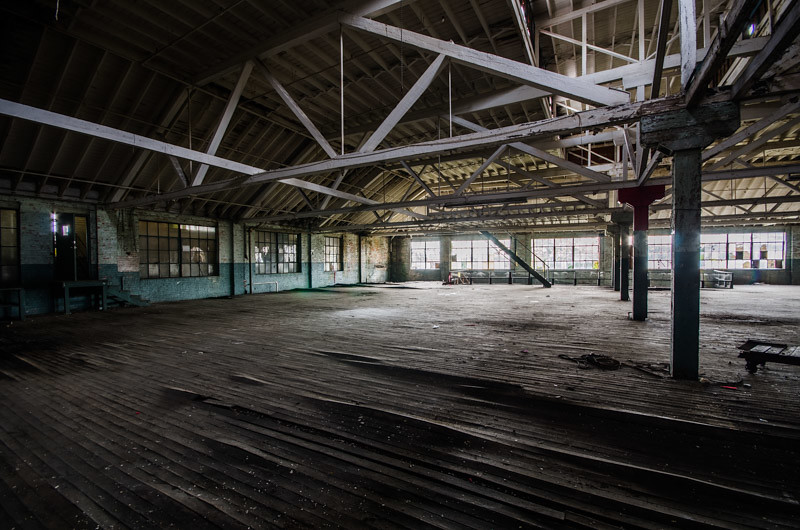
I want to click on hand rail, so click(728, 271).